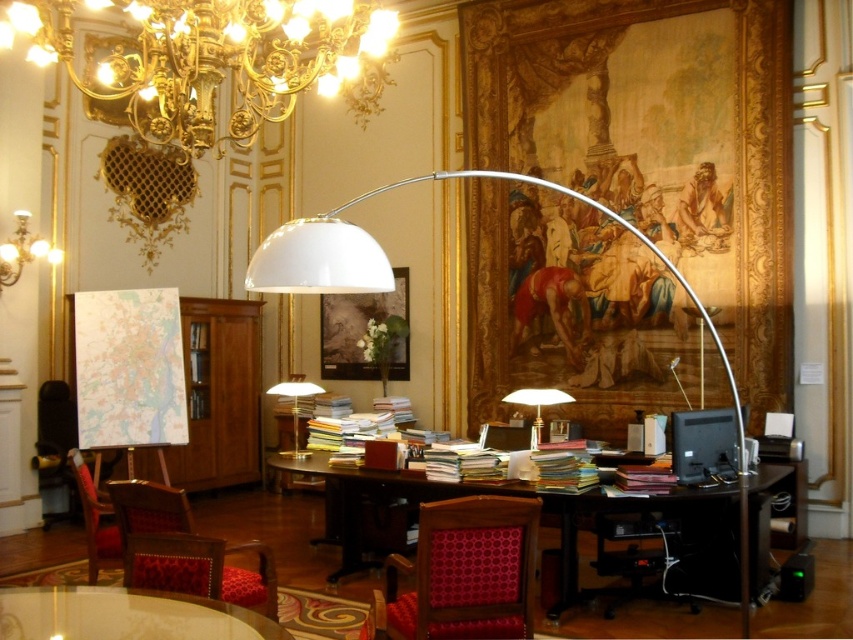
Does gold metallic chandelier at upper left have a smaller size compared to wooden bookshelf at left?

No.

I want to click on gold metallic chandelier at upper left, so coord(219,60).

In order to click on gold metallic chandelier at upper left in this screenshot , I will do tap(219, 60).

Does point (97, 552) lie in front of point (28, 236)?

Yes, point (97, 552) is in front of point (28, 236).

Looking at this image, which is more to the right, velvet red chair at lower left or matte gold chandelier at upper left?

velvet red chair at lower left

This screenshot has width=853, height=640. What do you see at coordinates (96, 520) in the screenshot?
I see `velvet red chair at lower left` at bounding box center [96, 520].

This screenshot has width=853, height=640. In order to click on velvet red chair at lower left in this screenshot , I will do `click(96, 520)`.

Where is `velvet red swivel chair at center`? The image size is (853, 640). velvet red swivel chair at center is located at coordinates (462, 573).

Does velvet red swivel chair at center have a smaller size compared to yellowish paper stack at right?

Actually, velvet red swivel chair at center might be larger than yellowish paper stack at right.

Does point (463, 618) lie in front of point (488, 481)?

Yes, point (463, 618) is in front of point (488, 481).

The height and width of the screenshot is (640, 853). In order to click on velvet red swivel chair at center in this screenshot , I will do `click(462, 573)`.